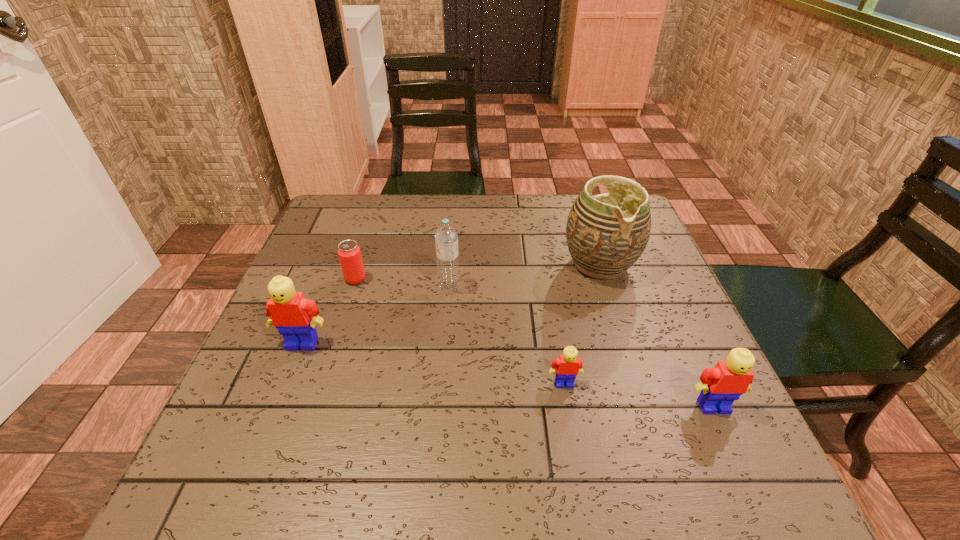
This screenshot has height=540, width=960. Find the location of `object that is at the near right corner`. object that is at the near right corner is located at coordinates (722, 385).

In the image, there is a desktop. At what (x,y) coordinates should I click in order to perform the action: click on free region at the far edge. Please return your answer as a coordinate pair (x, y). This screenshot has width=960, height=540. Looking at the image, I should click on (534, 223).

Where is `free space at the near edge of the desktop`? free space at the near edge of the desktop is located at coordinates (324, 420).

Image resolution: width=960 pixels, height=540 pixels. Identify the location of free location at the left edge. (328, 273).

Identify the location of vacant space at the right edge of the desktop. (644, 351).

The width and height of the screenshot is (960, 540). Find the location of `free space at the far left corner of the desktop`. free space at the far left corner of the desktop is located at coordinates [347, 217].

At what (x,y) coordinates should I click in order to perform the action: click on free spot at the near right corner of the desktop. Please return your answer as a coordinate pair (x, y). Looking at the image, I should click on (666, 414).

The height and width of the screenshot is (540, 960). Find the location of `free space between the beer can and the pottery`. free space between the beer can and the pottery is located at coordinates (477, 272).

Locate an element on the screen. The width and height of the screenshot is (960, 540). vacant region between the fourth farthest object and the second tallest Lego is located at coordinates (508, 375).

In order to click on free space between the leftmost Lego and the beer can in this screenshot , I will do `click(329, 311)`.